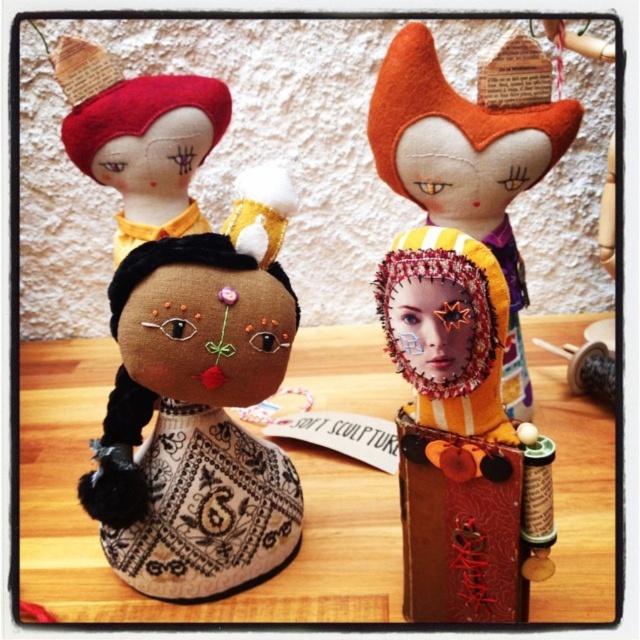
You are a child who wants to place a 10 inch ruler between the brown fabric doll at center and the orange felt doll at center. Can you fit the ruler between them?

The brown fabric doll at center and orange felt doll at center are 11.57 inches apart, so yes, the ruler can fit between them since it is shorter than the distance between the dolls.

You are organizing a doll display and need to know the vertical arrangement of the dolls. Which doll is positioned lower on the wooden surface between the brown fabric doll at center and the orange felt doll at center?

The brown fabric doll at center is located below the orange felt doll at center, so it is positioned lower on the wooden surface.

You are a visitor standing in front of the wooden table at center and the brown fabric doll at center. Which object is closer to you?

The wooden table at center is closer to you than the brown fabric doll at center.